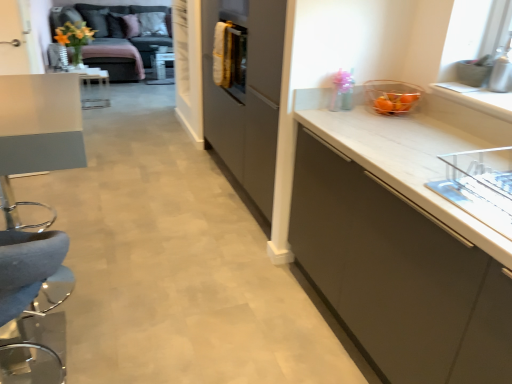
Question: Does matte gray table at left appear on the left side of white matte cabinet at right?

Choices:
 (A) yes
 (B) no

Answer: (A)

Question: Can you confirm if matte gray table at left is bigger than white matte cabinet at right?

Choices:
 (A) no
 (B) yes

Answer: (A)

Question: From a real-world perspective, is matte gray table at left positioned under white matte cabinet at right based on gravity?

Choices:
 (A) no
 (B) yes

Answer: (A)

Question: Is the surface of matte gray table at left in direct contact with white matte cabinet at right?

Choices:
 (A) no
 (B) yes

Answer: (A)

Question: Is matte gray table at left smaller than white matte cabinet at right?

Choices:
 (A) yes
 (B) no

Answer: (A)

Question: Is velvet grey couch at upper left taller or shorter than white matte cabinet at right?

Choices:
 (A) short
 (B) tall

Answer: (A)

Question: From a real-world perspective, is velvet grey couch at upper left above or below white matte cabinet at right?

Choices:
 (A) above
 (B) below

Answer: (B)

Question: Is point (117, 13) closer or farther from the camera than point (352, 329)?

Choices:
 (A) farther
 (B) closer

Answer: (A)

Question: Is velvet grey couch at upper left situated inside white matte cabinet at right or outside?

Choices:
 (A) outside
 (B) inside

Answer: (A)

Question: From the image's perspective, is matte yellow flower at upper left above or below matte gray table at left?

Choices:
 (A) above
 (B) below

Answer: (A)

Question: Is matte yellow flower at upper left situated inside matte gray table at left or outside?

Choices:
 (A) outside
 (B) inside

Answer: (A)

Question: Does point (55, 34) appear closer or farther from the camera than point (25, 110)?

Choices:
 (A) farther
 (B) closer

Answer: (A)

Question: From a real-world perspective, is matte yellow flower at upper left above or below matte gray table at left?

Choices:
 (A) above
 (B) below

Answer: (A)

Question: Is point (398, 109) closer or farther from the camera than point (13, 112)?

Choices:
 (A) farther
 (B) closer

Answer: (A)

Question: Is translucent glass bowl at upper right to the left or to the right of matte gray table at left in the image?

Choices:
 (A) left
 (B) right

Answer: (B)